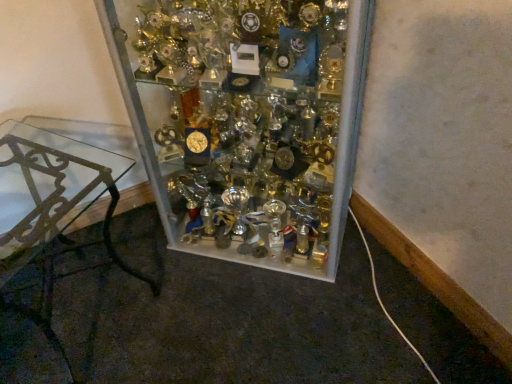
Measure the distance between clear glass trophy case at center and camera.

clear glass trophy case at center is 34.97 inches from camera.

The height and width of the screenshot is (384, 512). What do you see at coordinates (246, 121) in the screenshot? I see `clear glass trophy case at center` at bounding box center [246, 121].

In order to face clear glass trophy case at center, should I rotate leftwards or rightwards?

A 0.181 degree turn to the left will do.

Identify the location of clear glass trophy case at center. The width and height of the screenshot is (512, 384). (246, 121).

What is the approximate width of clear glass table at left?

It is 19.39 inches.

Image resolution: width=512 pixels, height=384 pixels. Identify the location of clear glass table at left. (54, 207).

What do you see at coordinates (54, 207) in the screenshot?
I see `clear glass table at left` at bounding box center [54, 207].

Locate an element on the screen. The height and width of the screenshot is (384, 512). clear glass trophy case at center is located at coordinates (246, 121).

Is clear glass trophy case at center to the left of clear glass table at left from the viewer's perspective?

No, clear glass trophy case at center is not to the left of clear glass table at left.

Is clear glass trophy case at center in front of or behind clear glass table at left in the image?

In the image, clear glass trophy case at center appears behind clear glass table at left.

Which point is more distant from viewer, (368, 18) or (77, 201)?

The point (368, 18) is farther.

From the image's perspective, which is below, clear glass trophy case at center or clear glass table at left?

clear glass table at left is shown below in the image.

From a real-world perspective, relative to clear glass table at left, is clear glass trophy case at center vertically above or below?

Clearly, from a real-world perspective, clear glass trophy case at center is above clear glass table at left.

Consider the image. Is clear glass trophy case at center wider or thinner than clear glass table at left?

clear glass trophy case at center is wider than clear glass table at left.

In terms of height, does clear glass trophy case at center look taller or shorter compared to clear glass table at left?

Considering their sizes, clear glass trophy case at center has more height than clear glass table at left.

Is clear glass trophy case at center bigger than clear glass table at left?

Yes, clear glass trophy case at center is bigger than clear glass table at left.

Is clear glass trophy case at center completely or partially outside of clear glass table at left?

Yes, clear glass trophy case at center is not within clear glass table at left.

Are clear glass trophy case at center and clear glass table at left located far from each other?

No.

Is clear glass trophy case at center turned away from clear glass table at left?

No.

What's the angular difference between clear glass trophy case at center and clear glass table at left's facing directions?

There is a 69.5-degree angle between the facing directions of clear glass trophy case at center and clear glass table at left.

The image size is (512, 384). What are the coordinates of `furniture lying below the clear glass trophy case at center (from the image's perspective)` in the screenshot? It's located at (54, 207).

Does clear glass table at left appear on the right side of clear glass trophy case at center?

In fact, clear glass table at left is to the left of clear glass trophy case at center.

Considering the positions of objects clear glass table at left and clear glass trophy case at center in the image provided, who is in front, clear glass table at left or clear glass trophy case at center?

clear glass table at left.

Which point is more forward, (30, 128) or (172, 138)?

The point (172, 138) is more forward.

From the image's perspective, which one is positioned higher, clear glass table at left or clear glass trophy case at center?

From the image's view, clear glass trophy case at center is above.

In the scene shown: From a real-world perspective, who is located higher, clear glass table at left or clear glass trophy case at center?

From a 3D spatial view, clear glass trophy case at center is above.

Which object is thinner, clear glass table at left or clear glass trophy case at center?

clear glass table at left is thinner.

Which of these two, clear glass table at left or clear glass trophy case at center, stands taller?

Standing taller between the two is clear glass trophy case at center.

Between clear glass table at left and clear glass trophy case at center, which one has larger size?

clear glass trophy case at center is bigger.

Would you say clear glass trophy case at center is part of clear glass table at left's contents?

No, clear glass trophy case at center is not surrounded by clear glass table at left.

Are clear glass table at left and clear glass trophy case at center far apart?

No, clear glass table at left is not far away from clear glass trophy case at center.

Is clear glass table at left aimed at clear glass trophy case at center?

No, clear glass table at left is not facing towards clear glass trophy case at center.

Can you tell me how much clear glass table at left and clear glass trophy case at center differ in facing direction?

The angle between the facing direction of clear glass table at left and the facing direction of clear glass trophy case at center is 69.5 degrees.

Where is `furniture in front of the clear glass trophy case at center`? The width and height of the screenshot is (512, 384). furniture in front of the clear glass trophy case at center is located at coordinates (54, 207).

Where is `glass box behind the clear glass table at left`? The width and height of the screenshot is (512, 384). glass box behind the clear glass table at left is located at coordinates (246, 121).

Where is `furniture located on the left of clear glass trophy case at center`? The height and width of the screenshot is (384, 512). furniture located on the left of clear glass trophy case at center is located at coordinates (54, 207).